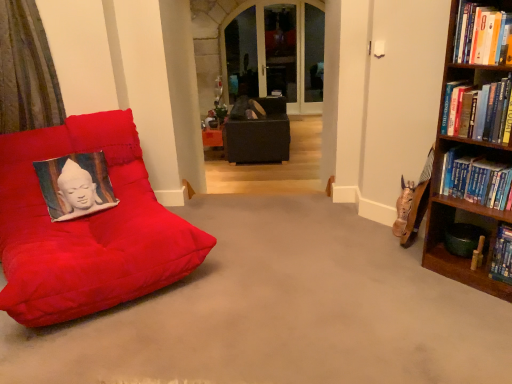
Image resolution: width=512 pixels, height=384 pixels. What do you see at coordinates (87, 227) in the screenshot? I see `suede red beanbag at left` at bounding box center [87, 227].

Locate an element on the screen. This screenshot has height=384, width=512. matte black bean bag at center is located at coordinates (257, 131).

Where is `suede red beanbag at left`? This screenshot has width=512, height=384. suede red beanbag at left is located at coordinates (87, 227).

From a real-world perspective, relative to textured fabric pillow at left, is hardcover book at upper right, the 2th book ordered from the bottom, vertically above or below?

hardcover book at upper right, the 2th book ordered from the bottom, is situated higher than textured fabric pillow at left in the real world.

Is hardcover book at upper right, the 2th book ordered from the bottom, far from textured fabric pillow at left?

Yes, hardcover book at upper right, the 2th book ordered from the bottom, is far from textured fabric pillow at left.

Is point (463, 136) more distant than point (68, 212)?

No, it is not.

From the textured fabric pillow at left, count 2nd books forward and point to it. Please provide its 2D coordinates.

[(478, 111)]

Considering the sizes of textured fabric pillow at left and suede red beanbag at left in the image, is textured fabric pillow at left wider or thinner than suede red beanbag at left?

In the image, textured fabric pillow at left appears to be more narrow than suede red beanbag at left.

Is point (99, 206) closer or farther from the camera than point (3, 178)?

Point (99, 206) is positioned farther from the camera compared to point (3, 178).

Who is more distant, textured fabric pillow at left or suede red beanbag at left?

textured fabric pillow at left is further away from the camera.

Considering the sizes of textured fabric pillow at left and suede red beanbag at left in the image, is textured fabric pillow at left bigger or smaller than suede red beanbag at left?

Clearly, textured fabric pillow at left is smaller in size than suede red beanbag at left.

From the image's perspective, which is above, suede red beanbag at left or hardcover book at right, arranged as the 1th book when ordered from the bottom?

hardcover book at right, arranged as the 1th book when ordered from the bottom, is shown above in the image.

In the image, is suede red beanbag at left on the left side or the right side of hardcover book at right, arranged as the 1th book when ordered from the bottom?

suede red beanbag at left is to the left of hardcover book at right, arranged as the 1th book when ordered from the bottom.

Who is taller, suede red beanbag at left or hardcover book at right, arranged as the 1th book when ordered from the bottom?

suede red beanbag at left.

Considering the points (128, 295) and (448, 154), which point is in front, point (128, 295) or point (448, 154)?

The point (128, 295) is more forward.

Is hardcover book at upper right, arranged as the first book when viewed from the top, next to hardcover book at right, arranged as the 1th book when ordered from the bottom, and touching it?

No, hardcover book at upper right, arranged as the first book when viewed from the top, is not beside hardcover book at right, arranged as the 1th book when ordered from the bottom.

Considering the relative sizes of hardcover book at upper right, arranged as the first book when viewed from the top, and hardcover book at right, acting as the third book starting from the top, in the image provided, is hardcover book at upper right, arranged as the first book when viewed from the top, thinner than hardcover book at right, acting as the third book starting from the top,?

Yes.

Is hardcover book at upper right, arranged as the first book when viewed from the top, aimed at hardcover book at right, acting as the third book starting from the top?

No, hardcover book at upper right, arranged as the first book when viewed from the top, is not aimed at hardcover book at right, acting as the third book starting from the top.

Based on the photo, which of these two, hardcover book at upper right, arranged as the first book when viewed from the top, or hardcover book at right, acting as the third book starting from the top, stands taller?

hardcover book at upper right, arranged as the first book when viewed from the top, is taller.

Does suede red beanbag at left appear on the right side of textured fabric pillow at left?

Indeed, suede red beanbag at left is positioned on the right side of textured fabric pillow at left.

Who is taller, suede red beanbag at left or textured fabric pillow at left?

With more height is suede red beanbag at left.

Is hardcover book at right, arranged as the 1th book when ordered from the bottom, looking in the opposite direction of suede red beanbag at left?

hardcover book at right, arranged as the 1th book when ordered from the bottom, does not have its back to suede red beanbag at left.

How far apart are hardcover book at right, acting as the third book starting from the top, and suede red beanbag at left?

hardcover book at right, acting as the third book starting from the top, is 5.81 feet away from suede red beanbag at left.

Which object is closer to the camera taking this photo, hardcover book at right, arranged as the 1th book when ordered from the bottom, or suede red beanbag at left?

suede red beanbag at left is in front.

Can you tell me how much matte black bean bag at center and hardcover book at upper right, the 2th book ordered from the bottom, differ in facing direction?

140 degrees separate the facing orientations of matte black bean bag at center and hardcover book at upper right, the 2th book ordered from the bottom.

Would you say matte black bean bag at center is a long distance from hardcover book at upper right, the 2th book ordered from the bottom?

Indeed, matte black bean bag at center is not near hardcover book at upper right, the 2th book ordered from the bottom.

Is matte black bean bag at center shorter than hardcover book at upper right, the 2th book ordered from the bottom?

No.

From the image's perspective, which one is positioned higher, matte black bean bag at center or hardcover book at upper right, arranged as the 2th book when viewed from the top?

matte black bean bag at center is shown above in the image.

Which book is the 2nd one when counting from the right side of the textured fabric pillow at left? Please provide its 2D coordinates.

[(478, 111)]

In order to click on furniture directly beneath the textured fabric pillow at left (from a real-world perspective) in this screenshot , I will do `click(87, 227)`.

Estimate the real-world distances between objects in this image. Which object is further from hardcover book at right, arranged as the 1th book when ordered from the bottom, suede red beanbag at left or hardcover book at upper right, arranged as the 2th book when viewed from the top?

The object further to hardcover book at right, arranged as the 1th book when ordered from the bottom, is suede red beanbag at left.

Based on their spatial positions, is matte black bean bag at center or hardcover book at upper right, arranged as the first book when viewed from the top, further from hardcover book at upper right, arranged as the 2th book when viewed from the top?

matte black bean bag at center is positioned further to the anchor hardcover book at upper right, arranged as the 2th book when viewed from the top.

Based on their spatial positions, is hardcover book at right, arranged as the 1th book when ordered from the bottom, or textured fabric pillow at left closer to hardcover book at upper right, acting as the 3th book starting from the bottom?

Based on the image, hardcover book at right, arranged as the 1th book when ordered from the bottom, appears to be nearer to hardcover book at upper right, acting as the 3th book starting from the bottom.

Looking at the image, which one is located closer to hardcover book at upper right, arranged as the first book when viewed from the top, suede red beanbag at left or matte black bean bag at center?

suede red beanbag at left is positioned closer to the anchor hardcover book at upper right, arranged as the first book when viewed from the top.

Considering their positions, is hardcover book at right, arranged as the 1th book when ordered from the bottom, positioned closer to suede red beanbag at left than hardcover book at upper right, arranged as the first book when viewed from the top?

hardcover book at right, arranged as the 1th book when ordered from the bottom, lies closer to suede red beanbag at left than the other object.

Based on their spatial positions, is hardcover book at upper right, arranged as the first book when viewed from the top, or matte black bean bag at center further from hardcover book at upper right, arranged as the 2th book when viewed from the top?

matte black bean bag at center is further to hardcover book at upper right, arranged as the 2th book when viewed from the top.

From the image, which object appears to be nearer to matte black bean bag at center, hardcover book at right, arranged as the 1th book when ordered from the bottom, or suede red beanbag at left?

Based on the image, suede red beanbag at left appears to be nearer to matte black bean bag at center.

Looking at this image, based on their spatial positions, is hardcover book at upper right, arranged as the 2th book when viewed from the top, or suede red beanbag at left closer to textured fabric pillow at left?

suede red beanbag at left lies closer to textured fabric pillow at left than the other object.

Where is `person between hardcover book at upper right, arranged as the 2th book when viewed from the top, and matte black bean bag at center, along the z-axis`? Image resolution: width=512 pixels, height=384 pixels. person between hardcover book at upper right, arranged as the 2th book when viewed from the top, and matte black bean bag at center, along the z-axis is located at coordinates (79, 192).

Find the location of a particular element. The height and width of the screenshot is (384, 512). book positioned between hardcover book at upper right, arranged as the 2th book when viewed from the top, and matte black bean bag at center from near to far is located at coordinates [476, 180].

Locate an element on the screen. furniture between textured fabric pillow at left and hardcover book at upper right, the 2th book ordered from the bottom, from left to right is located at coordinates (87, 227).

Where is `book located between textured fabric pillow at left and hardcover book at upper right, arranged as the 2th book when viewed from the top, in the left-right direction`? book located between textured fabric pillow at left and hardcover book at upper right, arranged as the 2th book when viewed from the top, in the left-right direction is located at coordinates (480, 34).